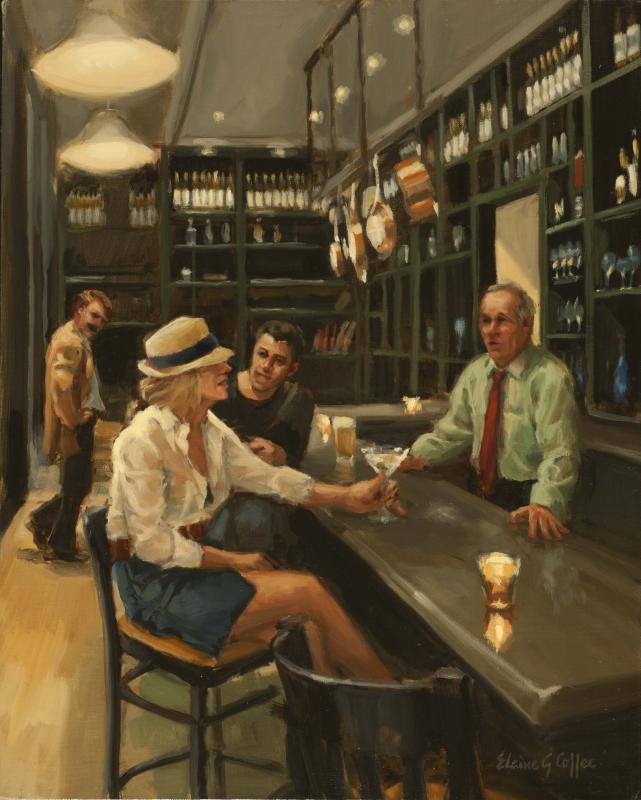
Find the location of a particular element. This screenshot has width=641, height=800. wine glasses is located at coordinates (637, 264), (574, 310).